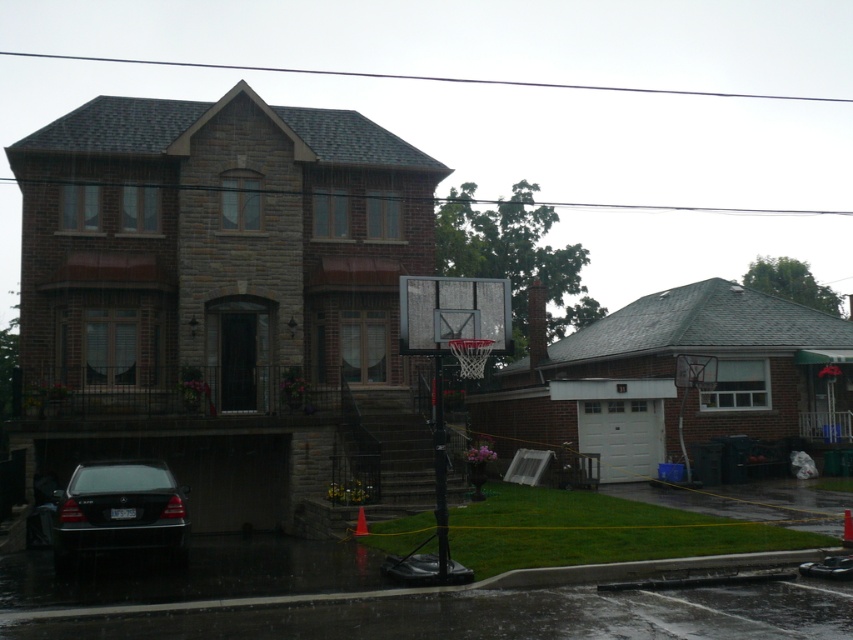
You are standing at the center of the image and want to throw a basketball to the metallic silver basketball hoop at center. Considering the distance, can you estimate whether you can make a successful shot without needing to run towards it?

The metallic silver basketball hoop at center is 39.42 feet away from you. A typical basketball shot from that distance would be challenging for most players, as professional players usually shoot from shorter distances. Without running or a running start, making a successful shot is unlikely.

You are a delivery person trying to park your 2.5 meters tall delivery van next to the shiny black sedan at lower left. Can the metallic silver basketball hoop at center block the van from parking there?

The metallic silver basketball hoop at center has a lesser height compared to shiny black sedan at lower left. Since the basketball hoop is shorter than the sedan, the van can park there without the hoop blocking it as the hoop is not taller than the sedan.

You are a delivery person trying to park your van, which is 4.5 meters long, between the metallic silver basketball hoop at center and the shiny black sedan at lower left. Can you fit your van there without touching either object?

The metallic silver basketball hoop at center and shiny black sedan at lower left are 4.48 meters apart. Since your van is 4.5 meters long, it is slightly longer than the available space, so you cannot fit the van there without touching either object.